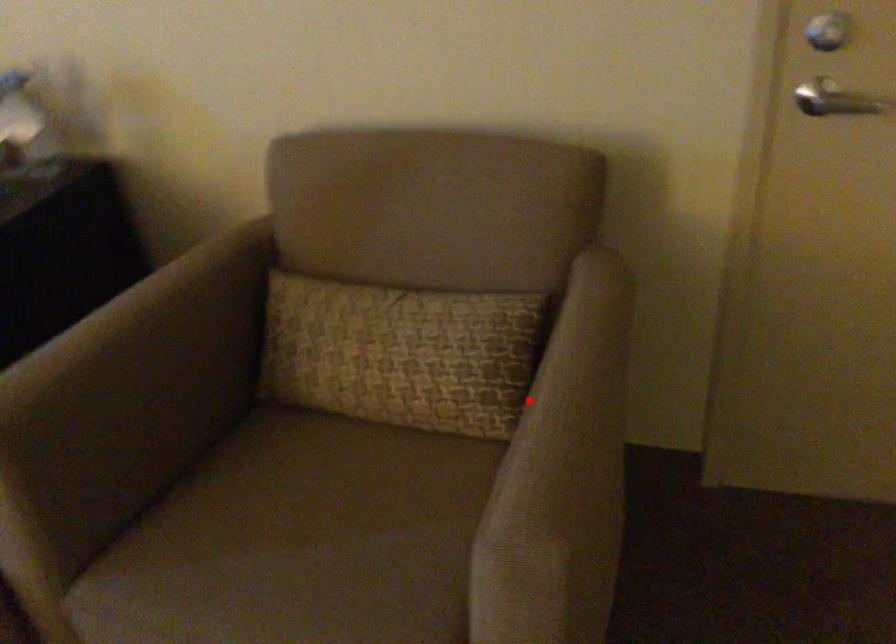
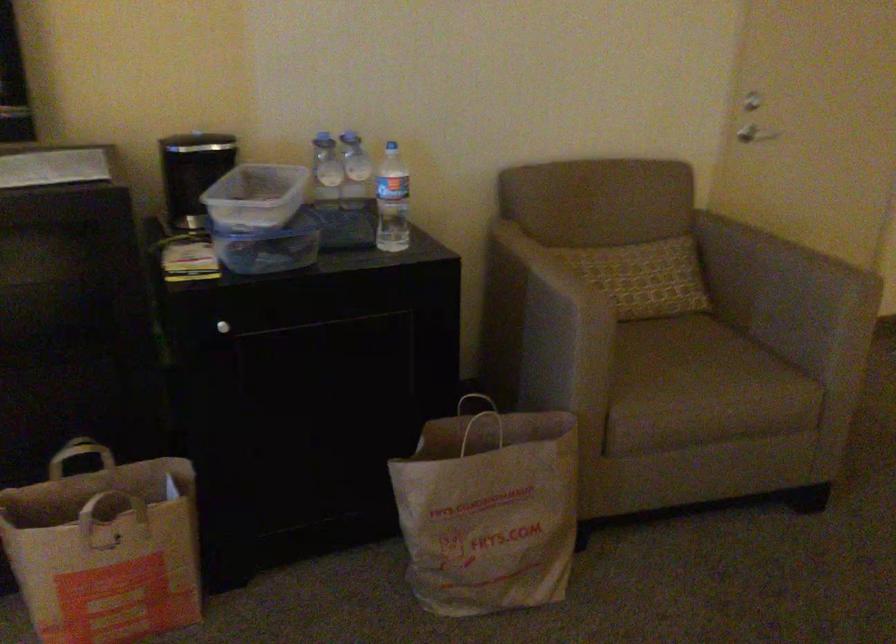
Locate, in the second image, the point that corresponds to the highlighted location in the first image.

(767, 259)